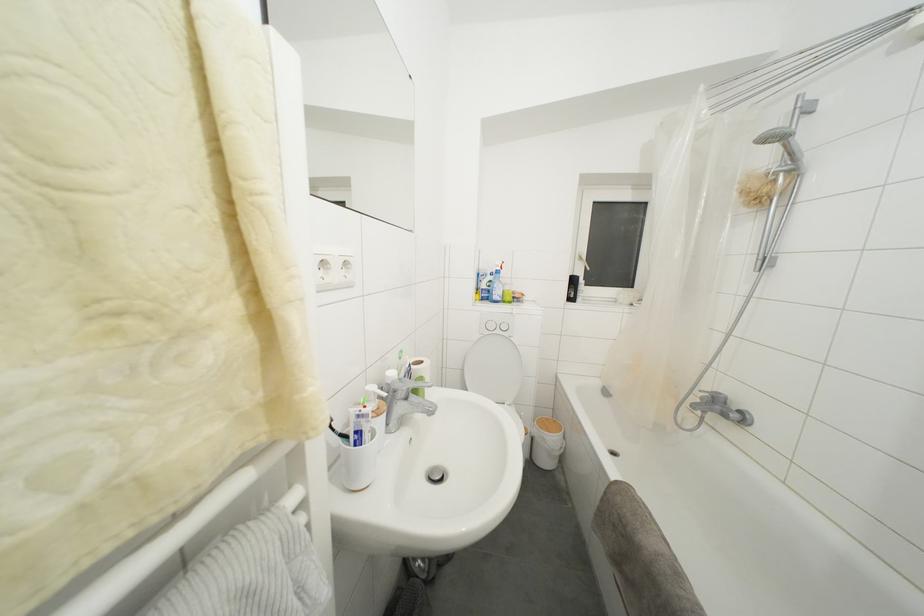
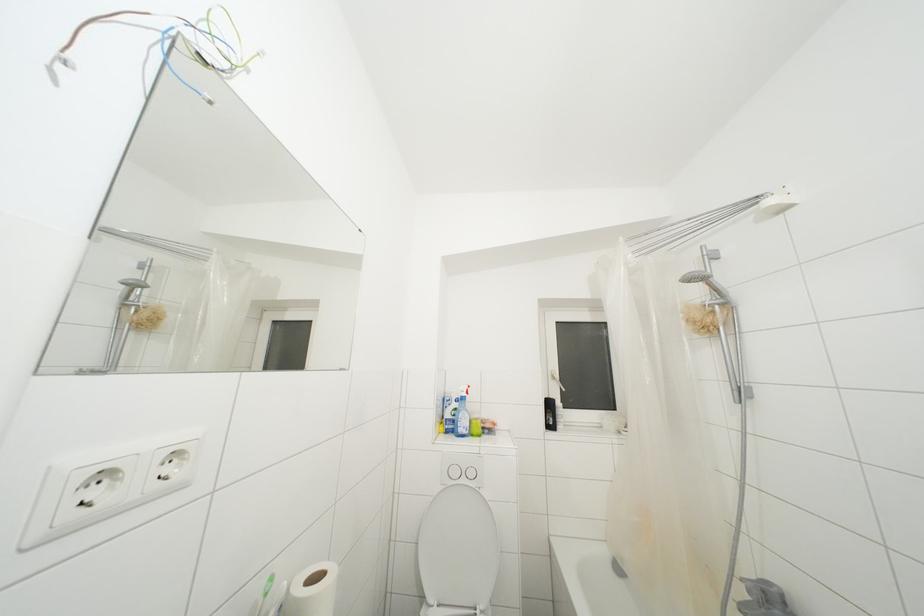
Question: Based on the continuous images, in which direction is the camera rotating? Reply with the corresponding letter.

Choices:
 (A) Left
 (B) Right
 (C) Up
 (D) Down

Answer: (C)